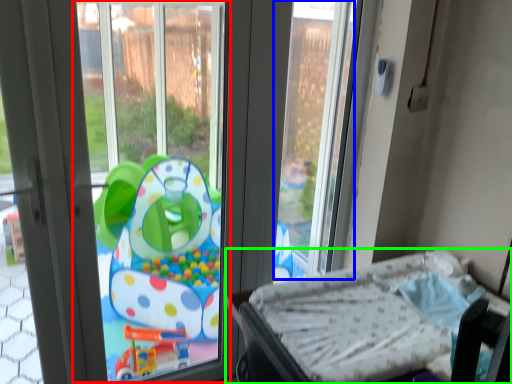
Question: Considering the real-world distances, which object is farthest from window screen (highlighted by a red box)? window screen (highlighted by a blue box) or furniture (highlighted by a green box)?

Choices:
 (A) window screen
 (B) furniture

Answer: (B)